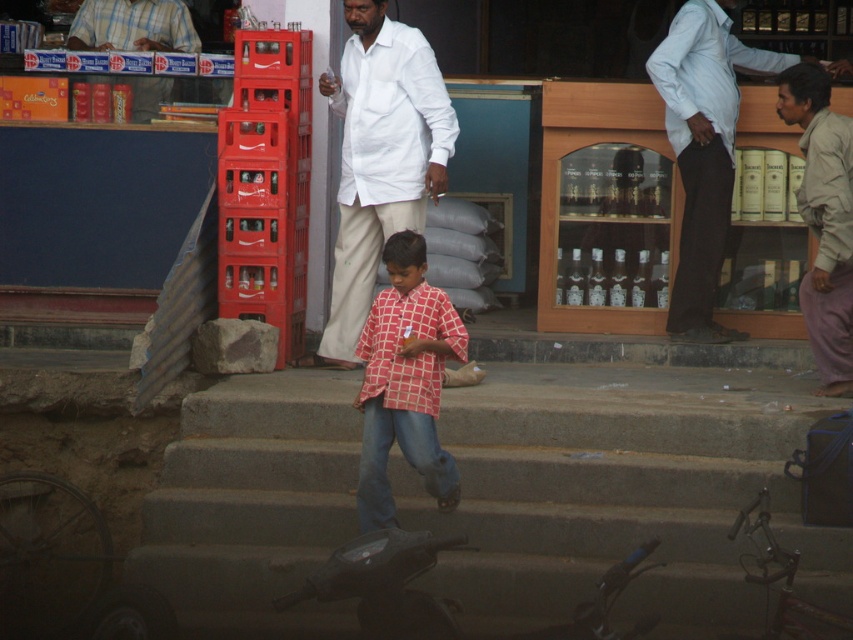
Is concrete stairs at center closer to the viewer compared to light beige pants at right?

Yes, it is.

Is the position of concrete stairs at center more distant than that of light beige pants at right?

No.

Is point (663, 628) closer to camera compared to point (828, 339)?

That is True.

What are the coordinates of `concrete stairs at center` in the screenshot? It's located at (621, 493).

Is white cotton shirt at center thinner than checkered fabric shirt at center?

No.

Does point (405, 35) come in front of point (418, 237)?

No, it is not.

I want to click on white cotton shirt at center, so click(380, 156).

Does checkered fabric shirt at center appear on the left side of blue denim jeans at center?

In fact, checkered fabric shirt at center is to the right of blue denim jeans at center.

Does checkered fabric shirt at center have a greater width compared to blue denim jeans at center?

Indeed, checkered fabric shirt at center has a greater width compared to blue denim jeans at center.

Who is more forward, (366, 433) or (421, 442)?

Point (421, 442) is more forward.

At what (x,y) coordinates should I click in order to perform the action: click on checkered fabric shirt at center. Please return your answer as a coordinate pair (x, y). This screenshot has height=640, width=853. Looking at the image, I should click on (404, 381).